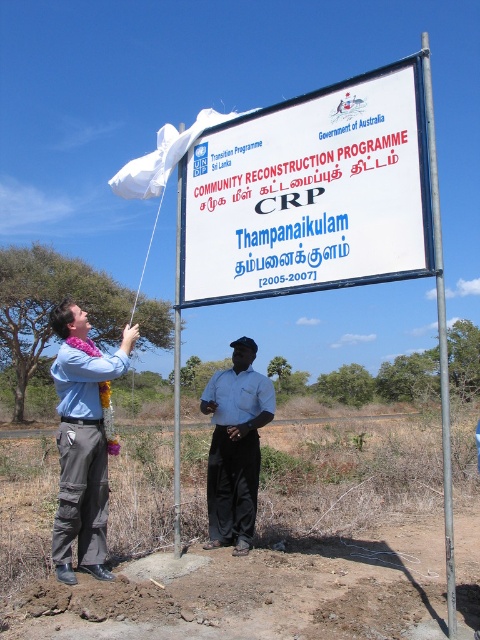
You are standing next to the white shirt at center and want to touch the white plastic sign at upper center. Can you reach it without moving your feet?

The distance between the white plastic sign at upper center and the white shirt at center is 6.19 feet. Since this distance is greater than an average person can reach, you cannot touch the sign without moving your feet.

You are a photographer standing at the base of the signpost. You want to take a photo that includes both the white shirt at center and the silver metallic pole at upper center. Which object will appear wider in the photo?

The silver metallic pole at upper center will appear wider in the photo because its width is greater than the white shirt at center.